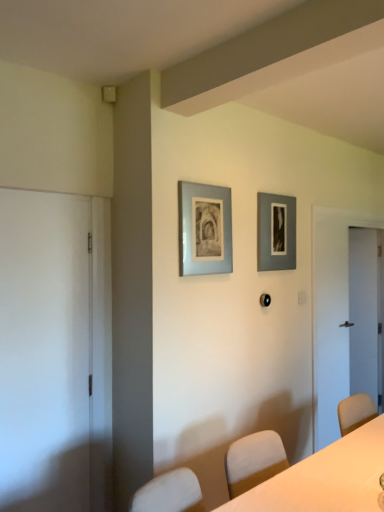
Question: Can white glossy door at right, the second door positioned from the front, be found inside matte gray picture frame at upper center, the first picture frame when ordered from back to front?

Choices:
 (A) no
 (B) yes

Answer: (A)

Question: Can you confirm if matte gray picture frame at upper center, the 2th picture frame viewed from the left, is positioned to the right of white glossy door at right, the first door when ordered from back to front?

Choices:
 (A) yes
 (B) no

Answer: (B)

Question: Can you confirm if matte gray picture frame at upper center, the 2th picture frame viewed from the left, is bigger than white glossy door at right, the second door positioned from the front?

Choices:
 (A) yes
 (B) no

Answer: (B)

Question: Is matte gray picture frame at upper center, the first picture frame when ordered from back to front, shorter than white glossy door at right, which ranks as the 1th door in right-to-left order?

Choices:
 (A) no
 (B) yes

Answer: (B)

Question: From the image's perspective, does matte gray picture frame at upper center, placed as the first picture frame when sorted from right to left, appear lower than white glossy door at right, which ranks as the 1th door in right-to-left order?

Choices:
 (A) yes
 (B) no

Answer: (B)

Question: From a real-world perspective, is matte gray picture frame at upper center, the first picture frame when ordered from back to front, on top of white glossy door at right, the 2th door from the left?

Choices:
 (A) no
 (B) yes

Answer: (B)

Question: Is white glossy door at right, the 2th door from the left, at the right side of white matte door at left, which is the first door from front to back?

Choices:
 (A) no
 (B) yes

Answer: (B)

Question: From a real-world perspective, is white glossy door at right, the 2th door from the left, located beneath white matte door at left, marked as the first door in a left-to-right arrangement?

Choices:
 (A) no
 (B) yes

Answer: (B)

Question: From the image's perspective, is white glossy door at right, the second door positioned from the front, below white matte door at left, marked as the first door in a left-to-right arrangement?

Choices:
 (A) no
 (B) yes

Answer: (B)

Question: Does white glossy door at right, which ranks as the 1th door in right-to-left order, appear on the left side of white matte door at left, the second door viewed from the back?

Choices:
 (A) yes
 (B) no

Answer: (B)

Question: Can you confirm if white glossy door at right, which ranks as the 1th door in right-to-left order, is thinner than white matte door at left, marked as the first door in a left-to-right arrangement?

Choices:
 (A) no
 (B) yes

Answer: (A)

Question: Is white matte door at left, marked as the first door in a left-to-right arrangement, inside white glossy door at right, the second door positioned from the front?

Choices:
 (A) yes
 (B) no

Answer: (B)

Question: Is white glossy table at center next to matte gray picture frame at upper center, the first picture frame when ordered from back to front, and touching it?

Choices:
 (A) yes
 (B) no

Answer: (B)